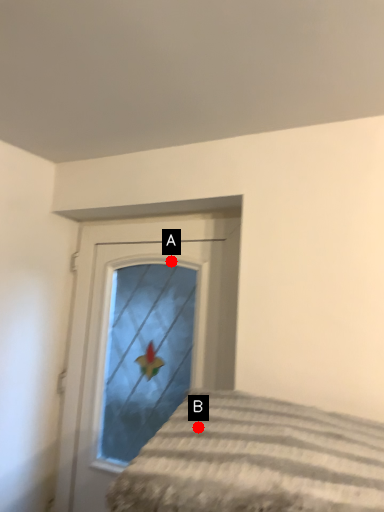
Question: Two points are circled on the image, labeled by A and B beside each circle. Which point is closer to the camera?

Choices:
 (A) A is closer
 (B) B is closer

Answer: (B)